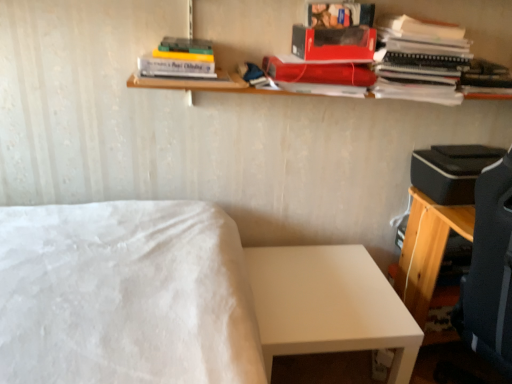
Locate an element on the screen. The image size is (512, 384). free space above shiny red paperback book at upper center, marked as the 2th paperback book in a bottom-to-top arrangement (from a real-world perspective) is located at coordinates (323, 60).